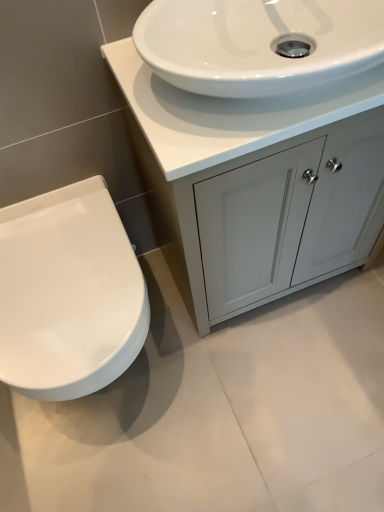
Question: Is white glossy toilet at left not near white glossy sink at upper center?

Choices:
 (A) no
 (B) yes

Answer: (A)

Question: From the image's perspective, is white glossy toilet at left under white glossy sink at upper center?

Choices:
 (A) yes
 (B) no

Answer: (A)

Question: Can you confirm if white glossy toilet at left is smaller than white glossy sink at upper center?

Choices:
 (A) no
 (B) yes

Answer: (A)

Question: Is the position of white glossy toilet at left more distant than that of white glossy sink at upper center?

Choices:
 (A) no
 (B) yes

Answer: (B)

Question: Is white glossy toilet at left looking in the opposite direction of white glossy sink at upper center?

Choices:
 (A) no
 (B) yes

Answer: (A)

Question: Would you say white glossy sink at upper center is part of white glossy toilet at left's contents?

Choices:
 (A) yes
 (B) no

Answer: (B)

Question: Is matte white cabinet at center positioned behind white glossy sink at upper center?

Choices:
 (A) yes
 (B) no

Answer: (A)

Question: From the image's perspective, is matte white cabinet at center beneath white glossy sink at upper center?

Choices:
 (A) yes
 (B) no

Answer: (A)

Question: Considering the relative positions of matte white cabinet at center and white glossy sink at upper center in the image provided, is matte white cabinet at center to the left of white glossy sink at upper center from the viewer's perspective?

Choices:
 (A) no
 (B) yes

Answer: (A)

Question: Does matte white cabinet at center have a lesser width compared to white glossy sink at upper center?

Choices:
 (A) yes
 (B) no

Answer: (B)

Question: Would you consider matte white cabinet at center to be distant from white glossy sink at upper center?

Choices:
 (A) yes
 (B) no

Answer: (B)

Question: Is matte white cabinet at center shorter than white glossy sink at upper center?

Choices:
 (A) no
 (B) yes

Answer: (A)

Question: From the image's perspective, does white glossy sink at upper center appear higher than white glossy toilet at left?

Choices:
 (A) yes
 (B) no

Answer: (A)